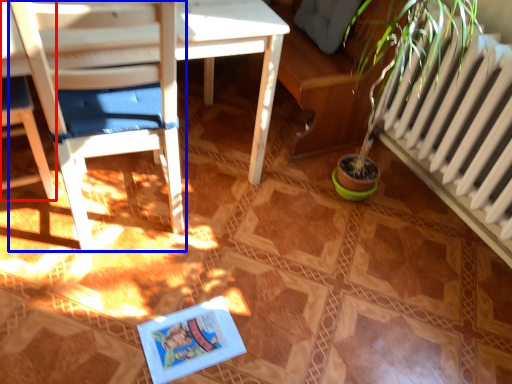
Question: Which object appears farthest to the camera in this image, chair (highlighted by a red box) or chair (highlighted by a blue box)?

Choices:
 (A) chair
 (B) chair

Answer: (A)